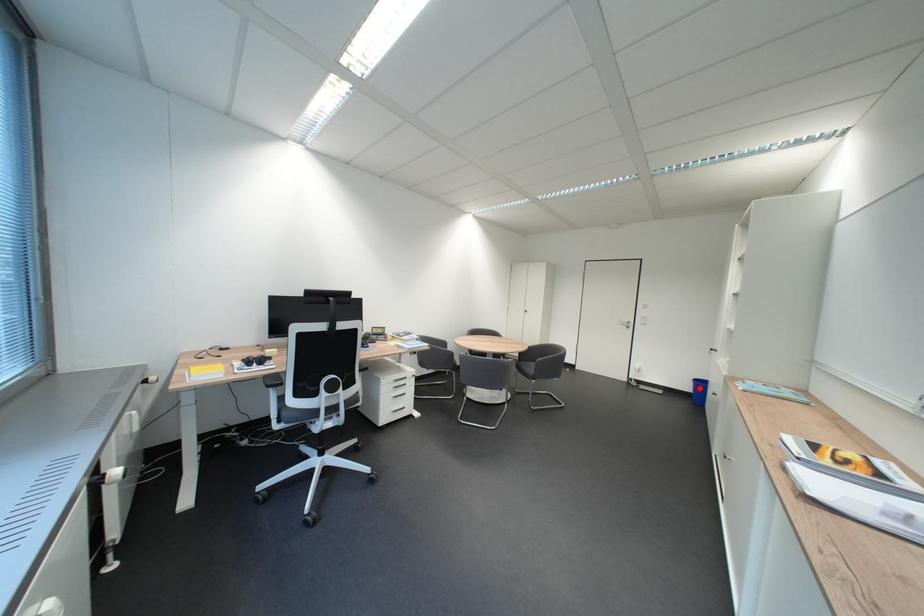
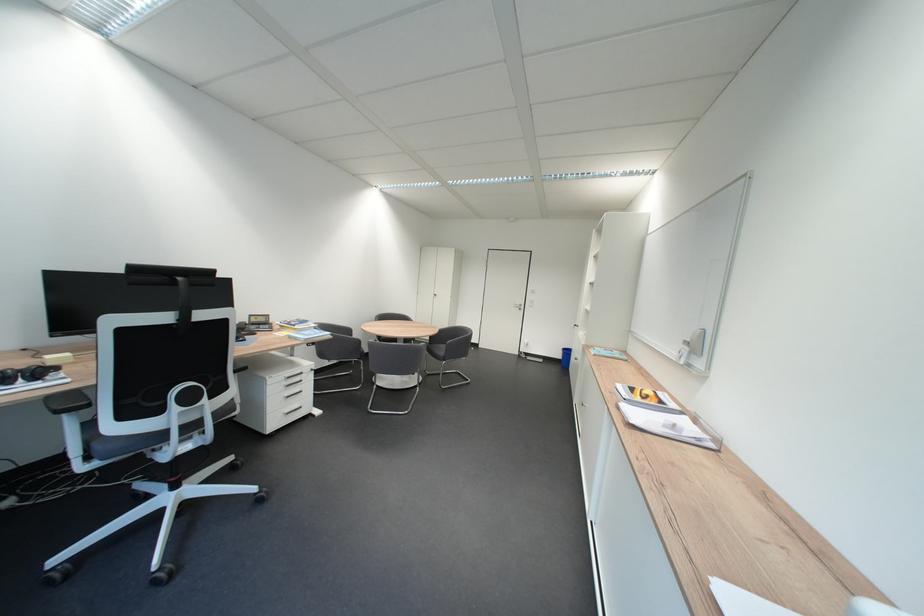
Locate, in the second image, the point that corresponds to the highlighted location in the first image.

(570, 357)